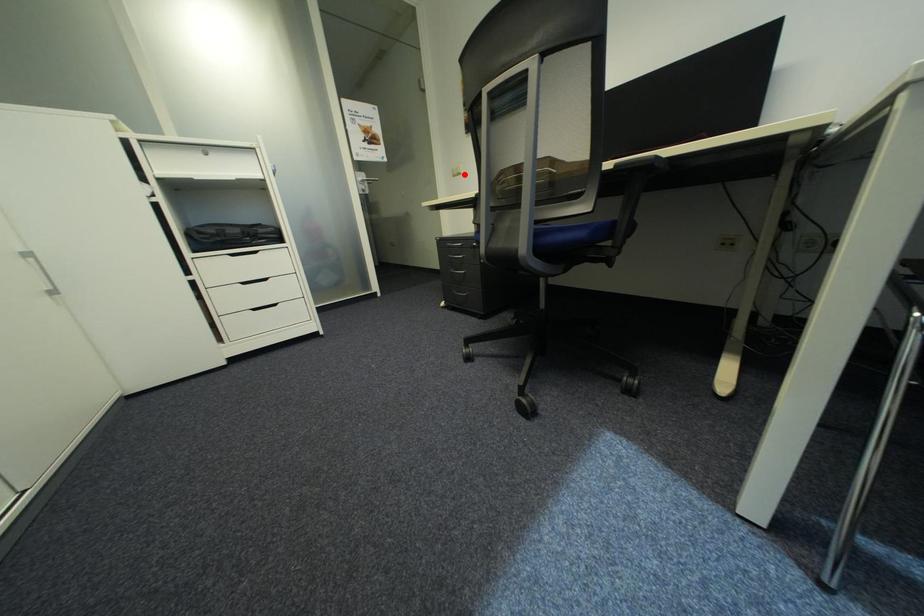
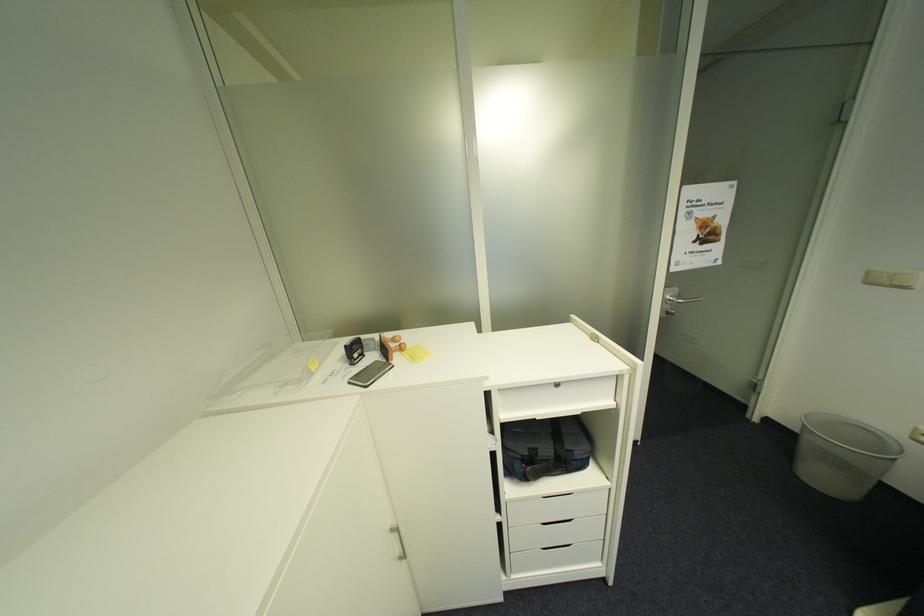
In the second image, find the point that corresponds to the highlighted location in the first image.

(895, 285)